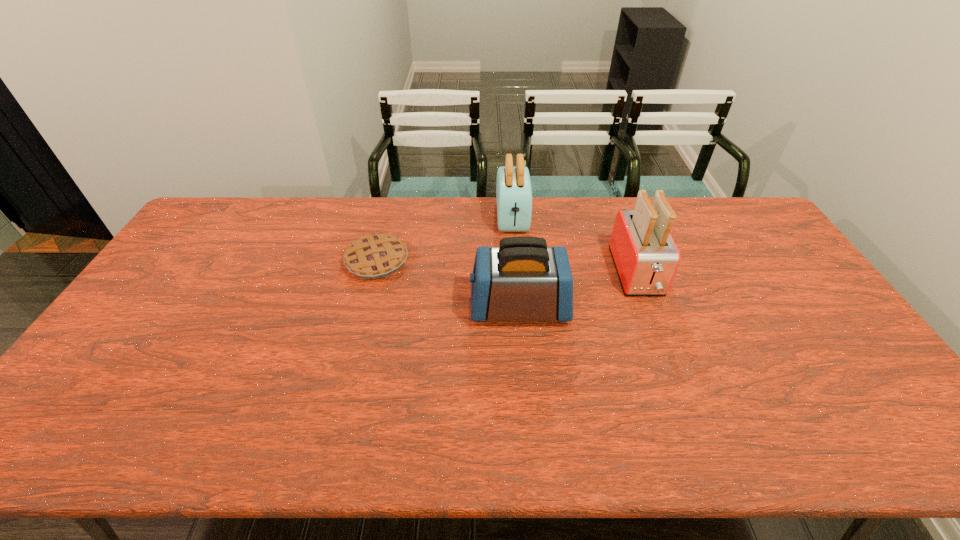
This screenshot has height=540, width=960. I want to click on the rightmost toaster, so click(645, 255).

Where is `the farthest toaster`? The height and width of the screenshot is (540, 960). the farthest toaster is located at coordinates (513, 186).

Where is `the leftmost object`? Image resolution: width=960 pixels, height=540 pixels. the leftmost object is located at coordinates (376, 256).

Find the location of a particular element. Image resolution: width=960 pixels, height=540 pixels. pie is located at coordinates (376, 256).

The height and width of the screenshot is (540, 960). I want to click on vacant position located 0.380m on the front-facing side of the rightmost object, so click(x=692, y=423).

Where is `vacant space situated 0.310m on the side of the farthest object with the lever`? The height and width of the screenshot is (540, 960). vacant space situated 0.310m on the side of the farthest object with the lever is located at coordinates (519, 305).

Locate an element on the screen. The height and width of the screenshot is (540, 960). vacant space situated on the left of the pie is located at coordinates (261, 261).

The height and width of the screenshot is (540, 960). What are the coordinates of `object that is at the far edge` in the screenshot? It's located at (513, 186).

This screenshot has width=960, height=540. In order to click on vacant region at the far edge in this screenshot , I will do `click(407, 200)`.

I want to click on free location at the near edge of the desktop, so click(x=636, y=450).